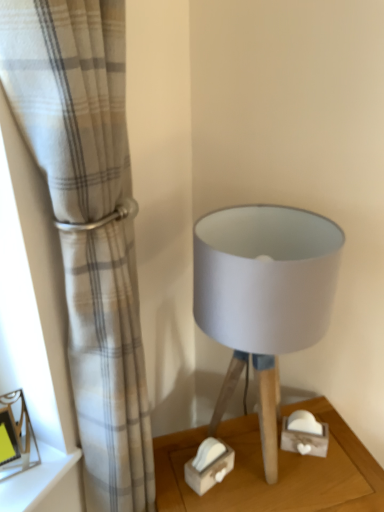
Describe the element at coordinates (279, 470) in the screenshot. I see `wooden table at lower right` at that location.

What is the approximate height of wooden tissue box at lower center?

wooden tissue box at lower center is 10.58 centimeters in height.

What do you see at coordinates (88, 224) in the screenshot? The image size is (384, 512). I see `white textured curtain at left` at bounding box center [88, 224].

Image resolution: width=384 pixels, height=512 pixels. What do you see at coordinates (45, 484) in the screenshot? I see `matte white frame at lower left` at bounding box center [45, 484].

Find the location of a particular element. The height and width of the screenshot is (512, 384). matte gray fabric lampshade at center is located at coordinates (264, 296).

Locate an element on the screen. wooden table at lower right is located at coordinates (279, 470).

Is matte white frame at lower left directly adjacent to matte gray fabric lampshade at center?

No, matte white frame at lower left is not beside matte gray fabric lampshade at center.

From the image's perspective, is matte white frame at lower left located above matte gray fabric lampshade at center?

No, from the image's perspective, matte white frame at lower left is not over matte gray fabric lampshade at center.

This screenshot has width=384, height=512. What are the coordinates of `shelf behind the matte gray fabric lampshade at center` in the screenshot? It's located at (45, 484).

Between point (65, 457) and point (237, 244), which one is positioned in front?

Positioned in front is point (65, 457).

From the image's perspective, is wooden tissue box at lower center located beneath wooden table at lower right?

No, from the image's perspective, wooden tissue box at lower center is not below wooden table at lower right.

Considering the positions of objects wooden tissue box at lower center and wooden table at lower right in the image provided, who is more to the left, wooden tissue box at lower center or wooden table at lower right?

wooden tissue box at lower center is more to the left.

Is point (215, 444) positioned behind point (235, 465)?

No, (215, 444) is closer to viewer.

Does wooden tissue box at lower center have a greater height compared to matte white frame at lower left?

Correct, wooden tissue box at lower center is much taller as matte white frame at lower left.

Where is `shelf located above the wooden tissue box at lower center (from a real-world perspective)`? The width and height of the screenshot is (384, 512). shelf located above the wooden tissue box at lower center (from a real-world perspective) is located at coordinates (45, 484).

Which object is positioned more to the right, wooden tissue box at lower center or matte white frame at lower left?

wooden tissue box at lower center is more to the right.

Measure the distance from wooden tissue box at lower center to matte white frame at lower left.

The distance of wooden tissue box at lower center from matte white frame at lower left is 12.54 inches.

Considering the relative sizes of wooden table at lower right and metallic gold picture frame at lower left in the image provided, is wooden table at lower right bigger than metallic gold picture frame at lower left?

Correct, wooden table at lower right is larger in size than metallic gold picture frame at lower left.

Find the location of a particular element. The image size is (384, 512). picture frame above the wooden table at lower right (from a real-world perspective) is located at coordinates (16, 437).

From a real-world perspective, is wooden table at lower right positioned under metallic gold picture frame at lower left based on gravity?

Yes.

Is point (191, 495) farther from viewer compared to point (5, 415)?

Yes.

Is point (141, 430) closer or farther from the camera than point (22, 488)?

Point (141, 430) appears to be farther away from the viewer than point (22, 488).

Is white textured curtain at left bigger than matte white frame at lower left?

Yes.

From the image's perspective, is white textured curtain at left located beneath matte white frame at lower left?

Actually, white textured curtain at left appears above matte white frame at lower left in the image.

From a real-world perspective, which is physically below, white textured curtain at left or matte gray fabric lampshade at center?

white textured curtain at left, from a real-world perspective.

Based on the photo, could you tell me if white textured curtain at left is facing matte gray fabric lampshade at center?

No, white textured curtain at left is not turned towards matte gray fabric lampshade at center.

Which point is more distant from viewer, (113,444) or (197,234)?

Positioned behind is point (197,234).

Can matte gray fabric lampshade at center be found inside white textured curtain at left?

That's incorrect, matte gray fabric lampshade at center is not inside white textured curtain at left.

From the image's perspective, which is below, matte white frame at lower left or white textured curtain at left?

matte white frame at lower left, from the image's perspective.

Is white textured curtain at left a part of matte white frame at lower left?

Definitely not — white textured curtain at left is not inside matte white frame at lower left.

Can you tell me how much matte white frame at lower left and white textured curtain at left differ in facing direction?

1.12 degrees.

Which of these two, matte white frame at lower left or white textured curtain at left, is thinner?

white textured curtain at left is thinner.

Find the location of a particular element. Image resolution: width=384 pixels, height=512 pixels. lamp located in front of the matte white frame at lower left is located at coordinates (264, 296).

I want to click on box above the wooden table at lower right (from a real-world perspective), so click(209, 465).

From the image, which object appears to be nearer to metallic gold picture frame at lower left, matte white frame at lower left or matte gray fabric lampshade at center?

matte white frame at lower left is positioned closer to the anchor metallic gold picture frame at lower left.

Looking at the image, which one is located further to white textured curtain at left, wooden tissue box at lower center or wooden table at lower right?

wooden tissue box at lower center lies further to white textured curtain at left than the other object.

When comparing their distances from wooden tissue box at lower center, does white textured curtain at left or matte gray fabric lampshade at center seem closer?

matte gray fabric lampshade at center lies closer to wooden tissue box at lower center than the other object.

When comparing their distances from wooden tissue box at lower center, does wooden table at lower right or metallic gold picture frame at lower left seem further?

The object further to wooden tissue box at lower center is metallic gold picture frame at lower left.

Considering their positions, is white textured curtain at left positioned further to matte gray fabric lampshade at center than wooden table at lower right?

wooden table at lower right is positioned further to the anchor matte gray fabric lampshade at center.

From the image, which object appears to be farther from white textured curtain at left, matte white frame at lower left or matte gray fabric lampshade at center?

Based on the image, matte white frame at lower left appears to be further to white textured curtain at left.

When comparing their distances from matte white frame at lower left, does metallic gold picture frame at lower left or wooden table at lower right seem closer?

metallic gold picture frame at lower left is closer to matte white frame at lower left.

Which object lies further to the anchor point metallic gold picture frame at lower left, matte white frame at lower left or white textured curtain at left?

white textured curtain at left.

This screenshot has width=384, height=512. Identify the location of box between metallic gold picture frame at lower left and wooden table at lower right in the horizontal direction. (209, 465).

At what (x,y) coordinates should I click in order to perform the action: click on box between matte white frame at lower left and matte gray fabric lampshade at center. Please return your answer as a coordinate pair (x, y). Looking at the image, I should click on (209, 465).

Image resolution: width=384 pixels, height=512 pixels. What are the coordinates of `curtain situated between matte white frame at lower left and wooden table at lower right from left to right` in the screenshot? It's located at (88, 224).

The image size is (384, 512). What are the coordinates of `lamp situated between matte white frame at lower left and wooden table at lower right from left to right` in the screenshot? It's located at (264, 296).